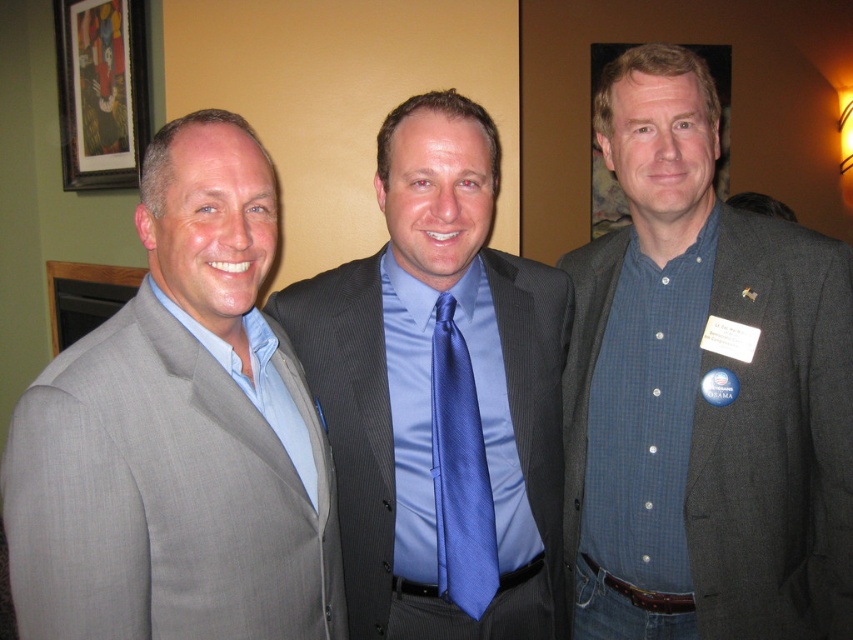
You are standing in front of the three men in the image. You need to place a small sticker exactly at the coordinates point (703,392). Which man should you target to place the sticker on his clothing?

The point (703,392) is located on the blue checkered shirt at center, so you should target the man in the center to place the sticker on his clothing.

You are a photographer standing at the center of the room, and you want to take a photo of the gray suit at left and the wooden framed artwork at upper left. Can you fit both in your camera frame if your camera has a maximum horizontal field of view of 2 meters?

The gray suit at left is 1.98 meters from the wooden framed artwork at upper left, so yes, both can be captured in the camera frame since the distance between them is just under the 2 meter limit.